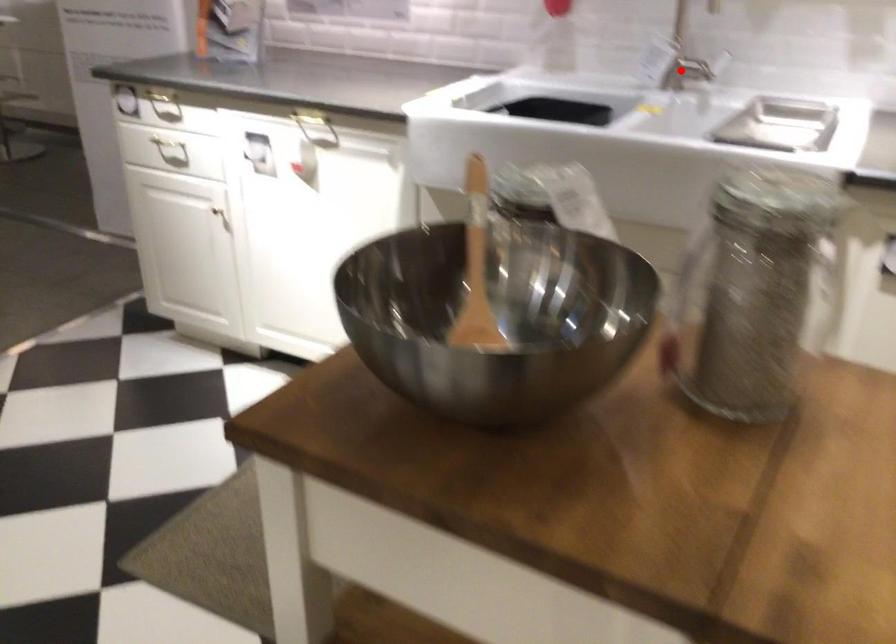
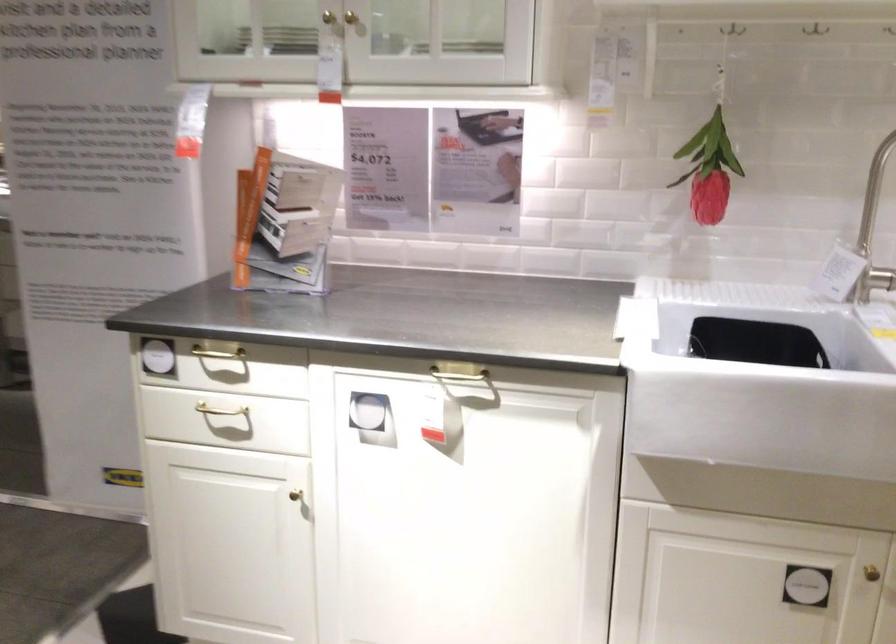
Find the pixel in the second image that matches the highlighted location in the first image.

(880, 278)